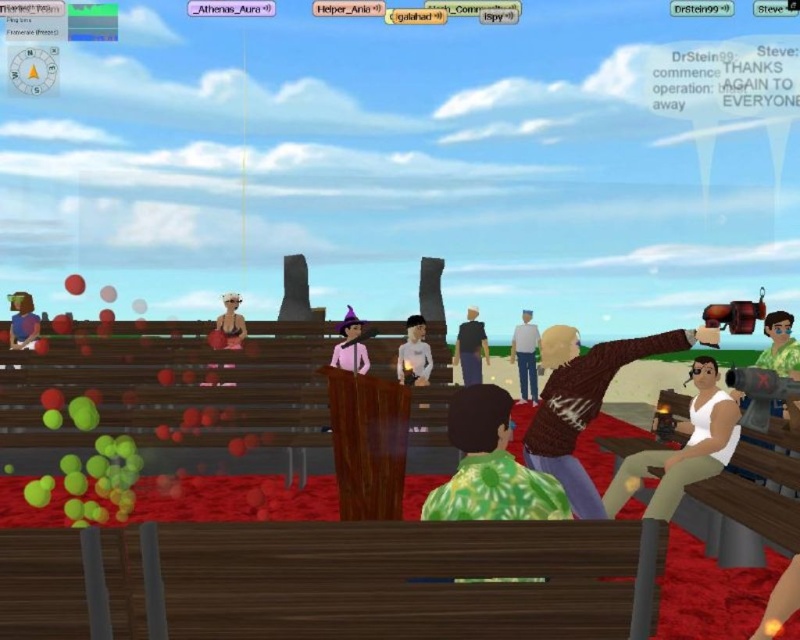
Question: From the image, what is the correct spatial relationship of white matte tank top at right in relation to pink matte wizard hat at center?

Choices:
 (A) above
 (B) below

Answer: (B)

Question: Considering the real-world distances, which object is closest to the knitted brown sweater at center?

Choices:
 (A) green tie-dye shirt at right
 (B) light gray sweater at center

Answer: (A)

Question: Can you confirm if matte black shirt at left is bigger than matte pink dress at center?

Choices:
 (A) no
 (B) yes

Answer: (B)

Question: Which object is closer to the camera taking this photo?

Choices:
 (A) green tie-dye shirt at center
 (B) matte black shirt at left

Answer: (A)

Question: Which is farther from the matte pink dress at center?

Choices:
 (A) wooden bench at lower right
 (B) green tie-dye shirt at right
 (C) knitted brown sweater at center
 (D) pink matte wizard hat at center

Answer: (A)

Question: Is wooden bench at center to the right of knitted brown sweater at center from the viewer's perspective?

Choices:
 (A) yes
 (B) no

Answer: (B)